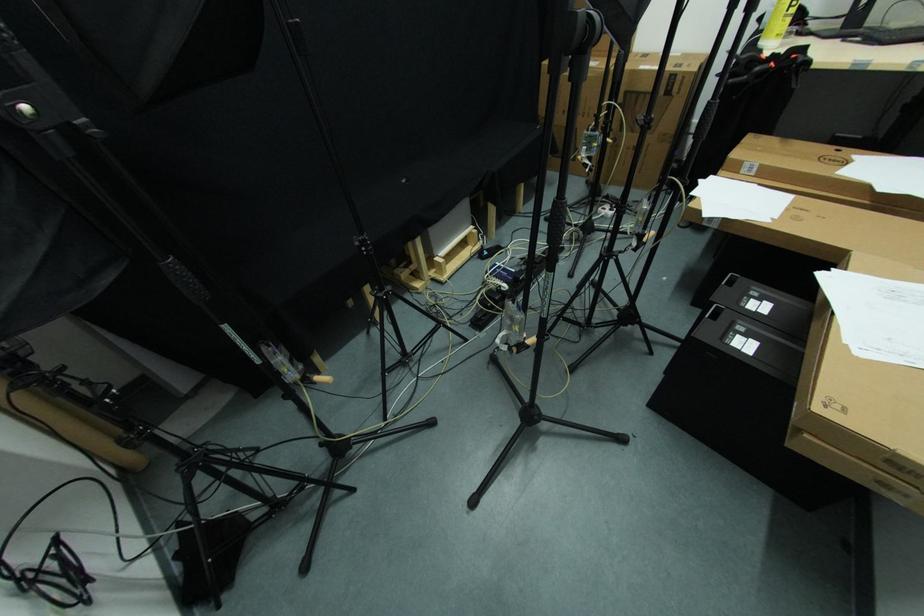
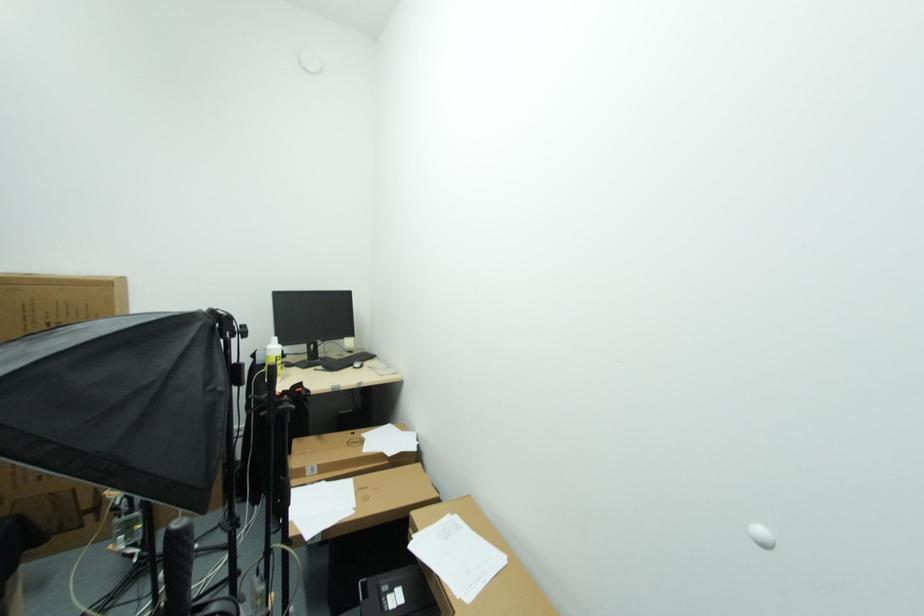
Locate, in the second image, the point that corresponds to pixel 830 273 in the first image.

(414, 541)